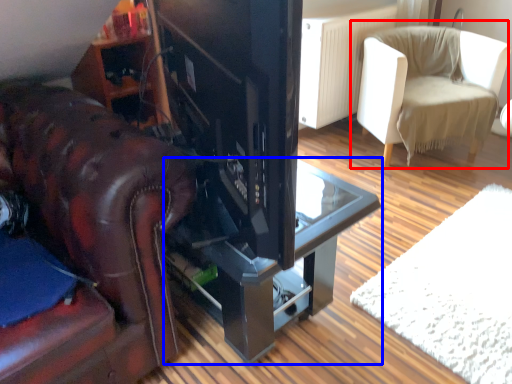
Question: Which point is further to the camera, chair (highlighted by a red box) or table (highlighted by a blue box)?

Choices:
 (A) chair
 (B) table

Answer: (A)